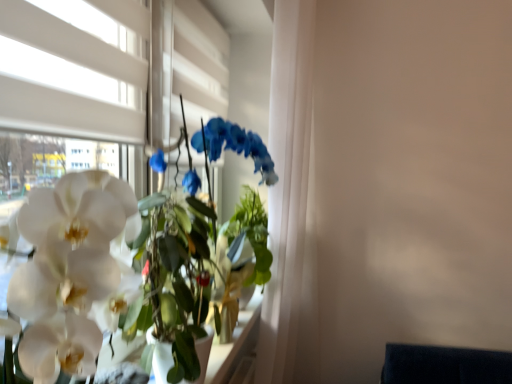
Question: From a real-world perspective, does white glossy orchid at left sit lower than white matte window at upper left?

Choices:
 (A) yes
 (B) no

Answer: (A)

Question: From the image's perspective, is white glossy orchid at left located above white matte window at upper left?

Choices:
 (A) yes
 (B) no

Answer: (B)

Question: Does white glossy orchid at left lie in front of white matte window at upper left?

Choices:
 (A) yes
 (B) no

Answer: (A)

Question: Could you tell me if white glossy orchid at left is turned towards white matte window at upper left?

Choices:
 (A) no
 (B) yes

Answer: (A)

Question: Is white glossy orchid at left at the right side of white matte window at upper left?

Choices:
 (A) no
 (B) yes

Answer: (B)

Question: Can you confirm if white glossy orchid at left is thinner than white matte window at upper left?

Choices:
 (A) yes
 (B) no

Answer: (B)

Question: Is white matte window at upper left wider than white glossy orchid at left?

Choices:
 (A) no
 (B) yes

Answer: (A)

Question: Is white matte window at upper left shorter than white glossy orchid at left?

Choices:
 (A) no
 (B) yes

Answer: (A)

Question: From a real-world perspective, is white matte window at upper left over white glossy orchid at left?

Choices:
 (A) no
 (B) yes

Answer: (B)

Question: Is white matte window at upper left aimed at white glossy orchid at left?

Choices:
 (A) yes
 (B) no

Answer: (B)

Question: Is the position of white matte window at upper left more distant than that of white glossy orchid at left?

Choices:
 (A) yes
 (B) no

Answer: (A)

Question: Is white matte window at upper left thinner than white glossy orchid at left?

Choices:
 (A) yes
 (B) no

Answer: (A)

Question: Is white glossy orchid at left bigger or smaller than white matte window at upper left?

Choices:
 (A) big
 (B) small

Answer: (A)